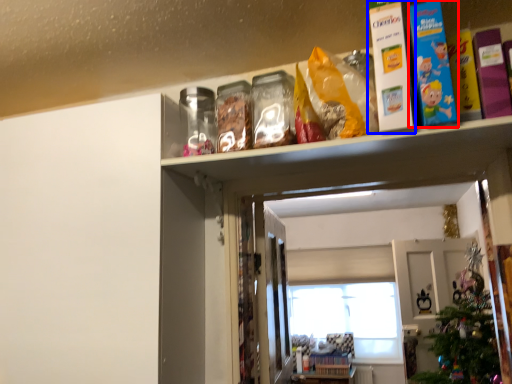
Question: Which of the following is the closest to the observer, book (highlighted by a red box) or book (highlighted by a blue box)?

Choices:
 (A) book
 (B) book

Answer: (A)